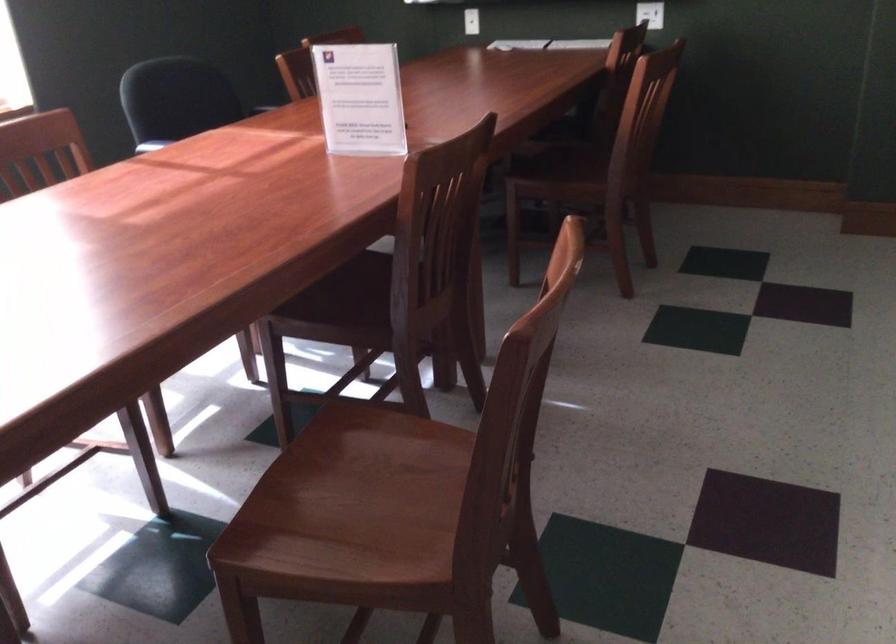
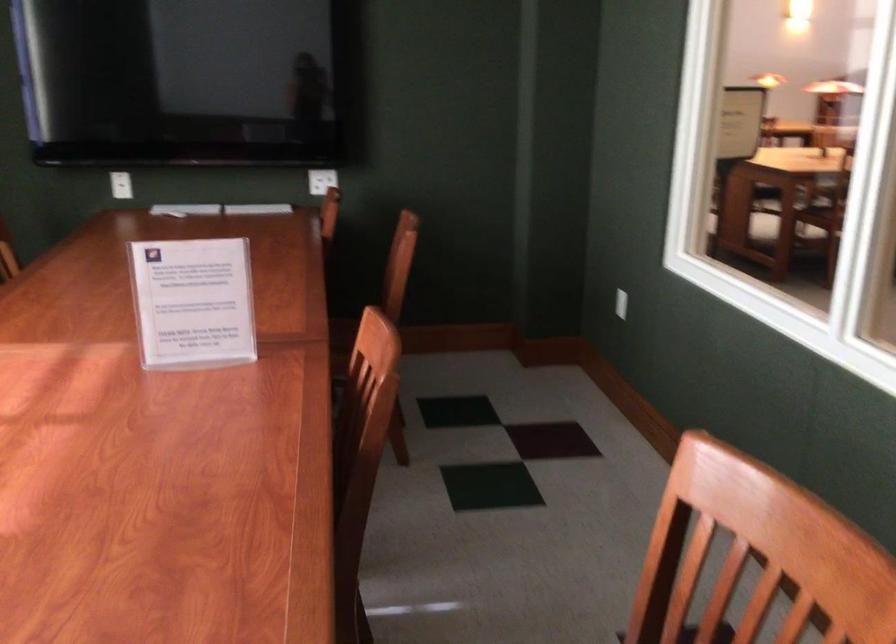
Question: I am providing you with two images of the same scene from different viewpoints. Which of the following objects are not visible in image2?

Choices:
 (A) acrylic sign holder
 (B) white robot figure
 (C) white light switch
 (D) wooden chair sitting surface

Answer: (D)